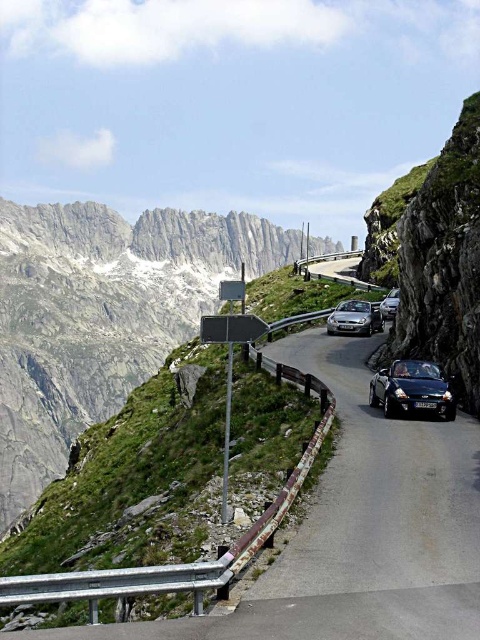
Can you confirm if metallic asphalt highway at center is positioned to the left of metallic silver car at center?

In fact, metallic asphalt highway at center is to the right of metallic silver car at center.

Does point (356, 275) come farther from viewer compared to point (344, 321)?

That is True.

Which is behind, point (300, 259) or point (360, 300)?

The point (300, 259) is behind.

You are a GUI agent. You are given a task and a screenshot of the screen. Output one action in this format:
    pyautogui.click(x=<x>, y=<y>)
    Task: Click on the metallic asphalt highway at center
    Image resolution: width=480 pixels, height=640 pixels.
    Given the screenshot: What is the action you would take?
    pyautogui.click(x=335, y=268)

Is rugged stone mountain at upper left bigger than metallic silver car at right?

Yes.

Find the location of a particular element. rugged stone mountain at upper left is located at coordinates (101, 316).

Between point (46, 413) and point (383, 308), which one is positioned behind?

Point (46, 413)

I want to click on rugged stone mountain at upper left, so click(101, 316).

Is point (420, 378) closer to viewer compared to point (395, 305)?

Yes.

Does black matte convertible at center come behind metallic silver car at right?

No, it is not.

Is point (399, 388) positioned behind point (391, 308)?

No, it is in front of (391, 308).

Where is `black matte convertible at center`? The height and width of the screenshot is (640, 480). black matte convertible at center is located at coordinates (411, 388).